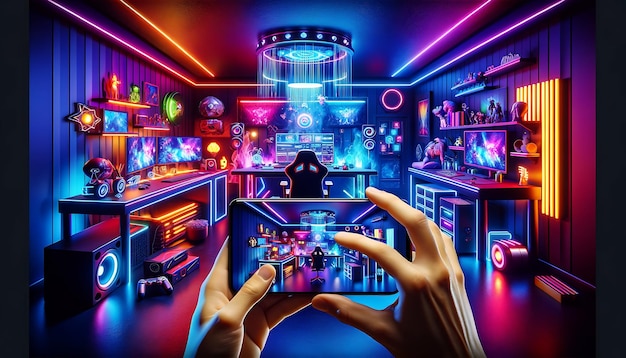
The width and height of the screenshot is (626, 358). I want to click on ceiling fixture, so 305,49.